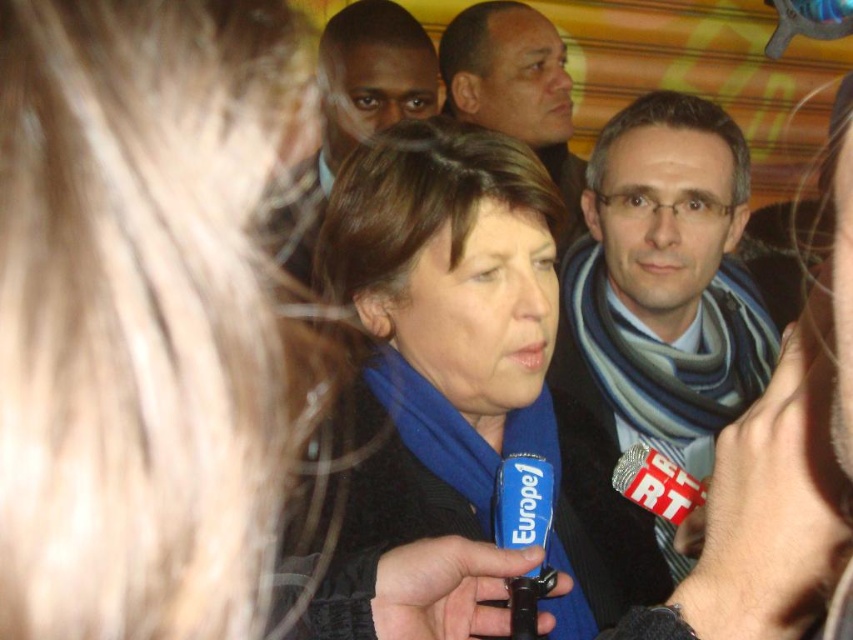
You are a photographer trying to capture a photo of the two points mentioned in the scene. Which point, point [685,104] or point [431,49], is closer to your camera lens?

Point [685,104] is closer to the camera than point [431,49].

In the scene shown: Based on the scene description, can you determine if the striped scarf at center is wider than the dark brown hair at upper left?

The striped scarf at center is wider than the dark brown hair at upper left according to the description.

You are a photographer at a press conference. You need to capture a closeup shot of the striped scarf at center and dark brown hair at upper left. What is the minimum distance you should set your camera lens to focus on to ensure both subjects are in focus?

The minimum distance to focus on both the striped scarf at center and dark brown hair at upper left should be at least 82.79 centimeters, which is the distance between them.